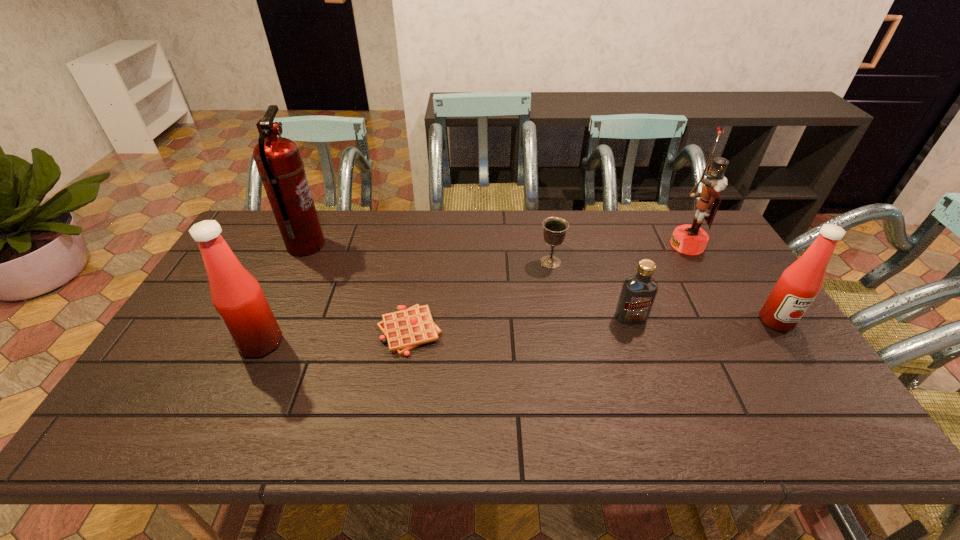
Find the location of `free space located on the front of the fourth object from left to right`. free space located on the front of the fourth object from left to right is located at coordinates (x=562, y=320).

Find the location of `vacant position located 0.130m on the front-facing side of the fifth object from left to right`. vacant position located 0.130m on the front-facing side of the fifth object from left to right is located at coordinates (646, 363).

Locate an element on the screen. The width and height of the screenshot is (960, 540). nutcracker that is at the far edge is located at coordinates (688, 239).

Locate an element on the screen. The width and height of the screenshot is (960, 540). fire extinguisher situated at the far edge is located at coordinates (278, 160).

Locate an element on the screen. condiment located in the right edge section of the desktop is located at coordinates (799, 284).

Find the location of a particular element. This screenshot has height=540, width=960. nutcracker that is positioned at the right edge is located at coordinates (688, 239).

In order to click on object that is positioned at the far right corner in this screenshot , I will do `click(688, 239)`.

You are a GUI agent. You are given a task and a screenshot of the screen. Output one action in this format:
    pyautogui.click(x=<x>, y=<y>)
    Task: Click on the free space at the far edge of the desktop
    This screenshot has width=960, height=540.
    Given the screenshot: What is the action you would take?
    pyautogui.click(x=601, y=240)

The height and width of the screenshot is (540, 960). In the image, there is a desktop. In order to click on vacant area at the near edge in this screenshot , I will do `click(425, 387)`.

In order to click on vacant area at the left edge in this screenshot , I will do `click(183, 319)`.